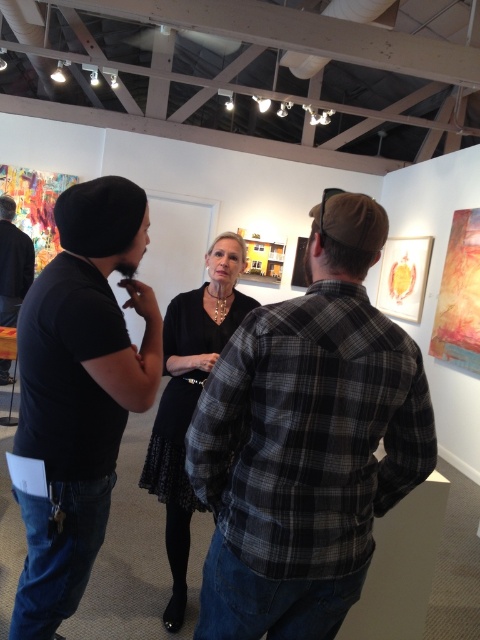
You are an event planner trying to arrange seating for a panel discussion. The two speakers are wearing the plaid flannel shirt at center and the matte black shirt at left. Which speaker should you seat in the taller chair to match their height?

The matte black shirt at left should be seated in the taller chair since the plaid flannel shirt at center is not as tall as the matte black shirt at left.

You are standing in the art gallery and want to take a photo of both the point at coordinates (298,598) and the point at coordinates (7,237). Which point will appear larger in your photo?

The point at coordinates (298,598) will appear larger in the photo because it is closer to the camera than the point at coordinates (7,237).